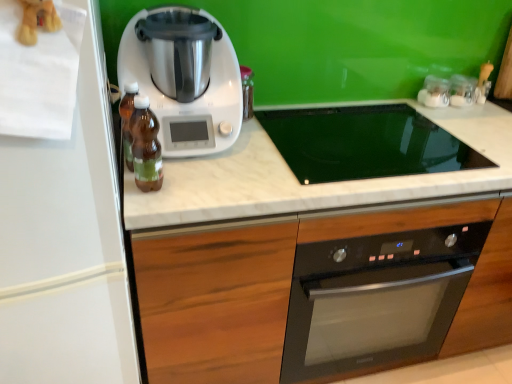
Identify the location of vacant area that lies between white plastic kitchen appliance at center and brown glass bottle at center, marked as the second bottle in a back-to-front arrangement. The width and height of the screenshot is (512, 384). (195, 172).